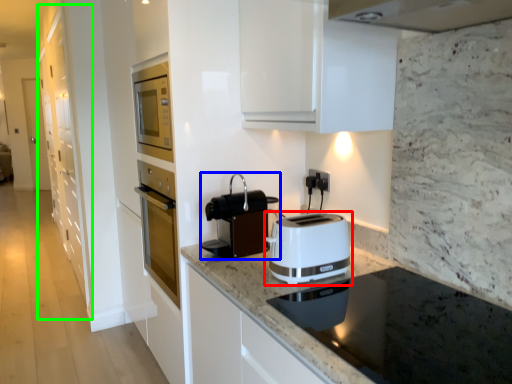
Question: Based on their relative distances, which object is nearer to toaster (highlighted by a red box)? Choose from kitchen appliance (highlighted by a blue box) and cabinetry (highlighted by a green box).

Choices:
 (A) kitchen appliance
 (B) cabinetry

Answer: (A)